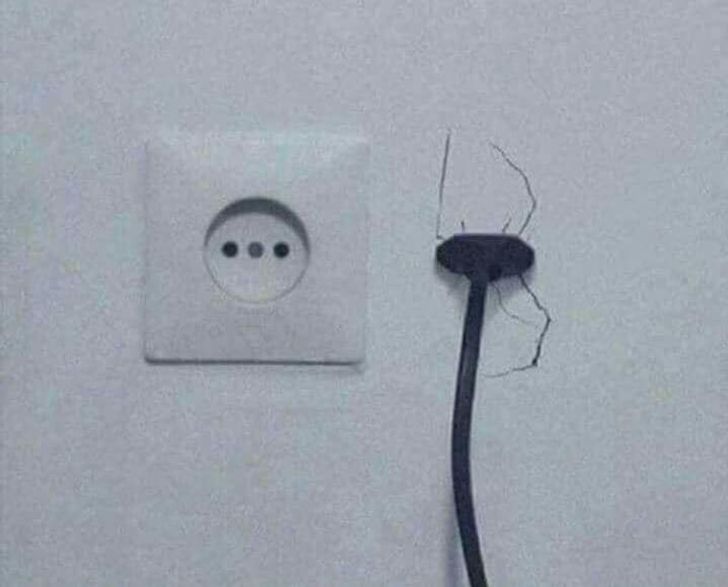
This screenshot has height=587, width=728. I want to click on cracks in wall, so click(440, 245), click(459, 222), click(506, 225), click(499, 286).